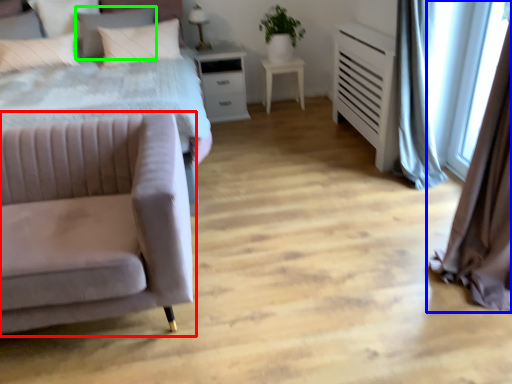
Question: Considering the real-world distances, which object is farthest from studio couch (highlighted by a red box)? curtain (highlighted by a blue box) or pillow (highlighted by a green box)?

Choices:
 (A) curtain
 (B) pillow

Answer: (B)